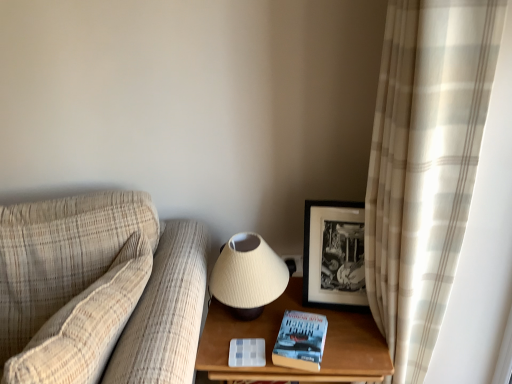
Where is `vacant space underneath matte cream lampshade at center (from a real-world perspective)`? The image size is (512, 384). vacant space underneath matte cream lampshade at center (from a real-world perspective) is located at coordinates (254, 316).